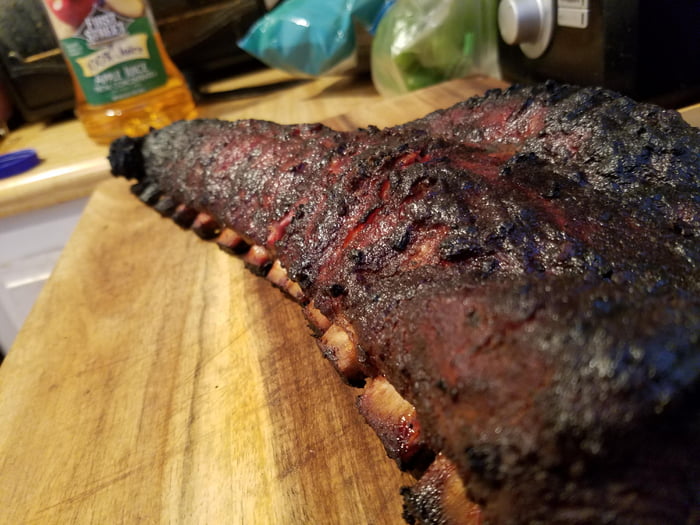
The width and height of the screenshot is (700, 525). What are the coordinates of `bottle of apple juice` in the screenshot? It's located at (139, 94).